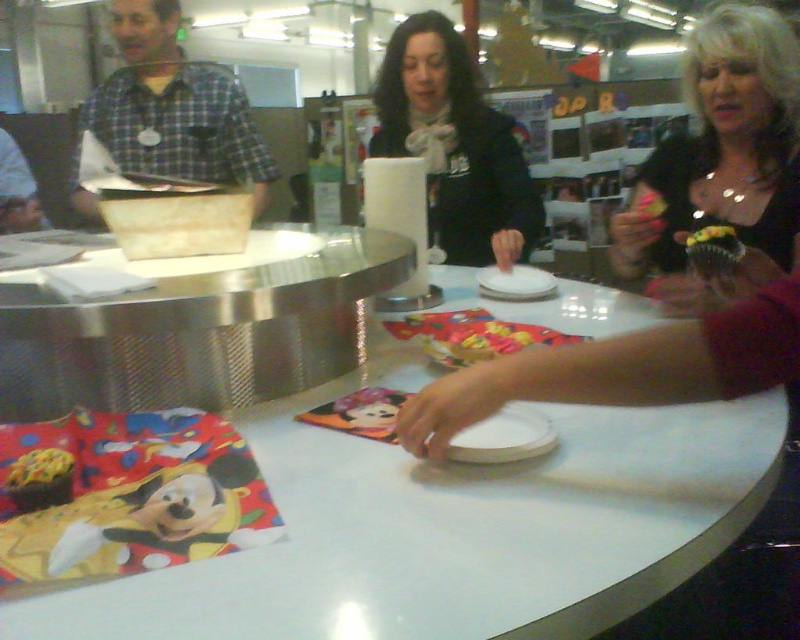
Which of these two, shiny black dress at center or plaid shirt at left, stands shorter?

shiny black dress at center

Which is more to the right, shiny black dress at center or plaid shirt at left?

Positioned to the right is shiny black dress at center.

Who is more forward, [701,122] or [122,83]?

Positioned in front is point [701,122].

Image resolution: width=800 pixels, height=640 pixels. What are the coordinates of `shiny black dress at center` in the screenshot? It's located at (721, 156).

Who is positioned more to the right, shiny black dress at center or green frosted cupcake at center right?

shiny black dress at center

Can you confirm if shiny black dress at center is taller than green frosted cupcake at center right?

Indeed, shiny black dress at center has a greater height compared to green frosted cupcake at center right.

Locate an element on the screen. The image size is (800, 640). shiny black dress at center is located at coordinates point(721,156).

Which is in front, point (482, 253) or point (184, 125)?

Point (482, 253) is more forward.

Consider the image. Measure the distance between point (504, 237) and camera.

Point (504, 237) is 5.43 feet from camera.

Which is in front, point (509, 237) or point (144, 163)?

Point (509, 237) is more forward.

Find the location of a particular element. The height and width of the screenshot is (640, 800). black matte scarf at center is located at coordinates (454, 145).